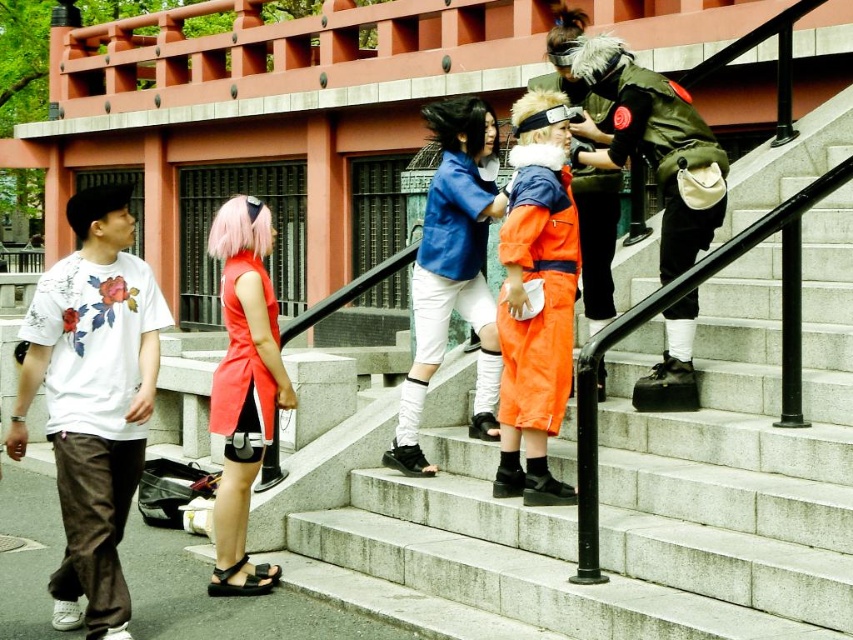
Question: Which point is farther to the camera?

Choices:
 (A) orange fabric jacket at center
 (B) green fabric jacket at upper right
 (C) vivid orange fabric dress at center
 (D) black leather sandal at lower left

Answer: (B)

Question: Which object is the closest to the black leather sandal at lower left?

Choices:
 (A) orange fabric jacket at center
 (B) green fabric jacket at upper right
 (C) white cotton t-shirt at left

Answer: (C)

Question: Is green fabric jacket at upper right to the left of black leather sandal at lower left from the viewer's perspective?

Choices:
 (A) yes
 (B) no

Answer: (B)

Question: Considering the relative positions of blue fabric jacket at center and vivid orange fabric dress at center in the image provided, where is blue fabric jacket at center located with respect to vivid orange fabric dress at center?

Choices:
 (A) right
 (B) left

Answer: (A)

Question: Can you confirm if white cotton t-shirt at left is positioned to the left of green fabric jacket at upper right?

Choices:
 (A) no
 (B) yes

Answer: (B)

Question: Based on their relative distances, which object is farther from the vivid orange fabric dress at center?

Choices:
 (A) orange fabric jacket at center
 (B) white cotton t-shirt at left

Answer: (A)